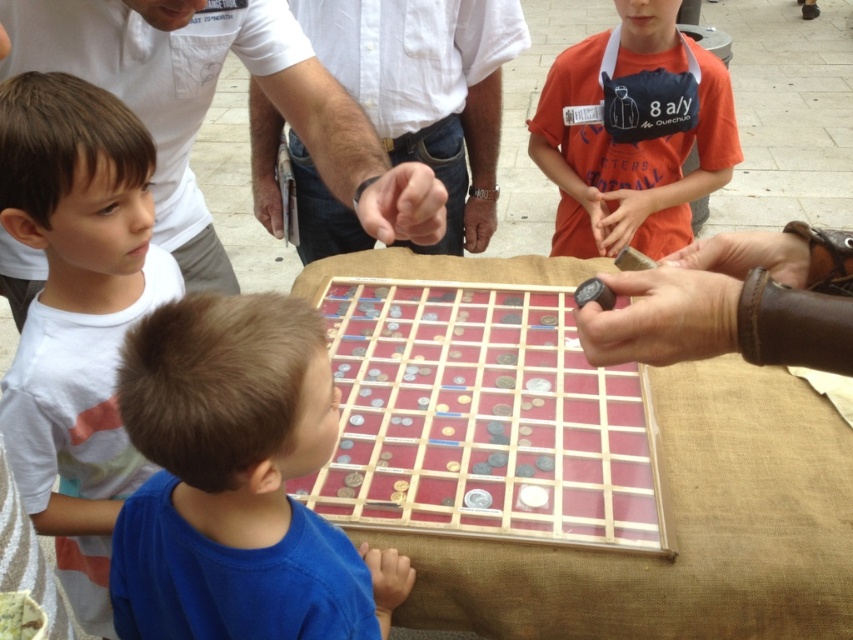
Is point (392, 445) farther from camera compared to point (194, 548)?

Yes, it is behind point (194, 548).

Is point (393, 413) in front of point (311, 636)?

No, (393, 413) is behind (311, 636).

Which is in front, point (612, 388) or point (213, 429)?

Positioned in front is point (213, 429).

At what (x,y) coordinates should I click in order to perform the action: click on wooden grid at center. Please return your answer as a coordinate pair (x, y). The image size is (853, 640). Looking at the image, I should click on (485, 419).

Between white cotton shirt at left and white shirt at upper center, which one is positioned lower?

Positioned lower is white cotton shirt at left.

Can you confirm if white cotton shirt at left is positioned to the right of white shirt at upper center?

No, white cotton shirt at left is not to the right of white shirt at upper center.

Between point (44, 449) and point (184, 36), which one is positioned in front?

Positioned in front is point (44, 449).

Image resolution: width=853 pixels, height=640 pixels. In order to click on white cotton shirt at left in this screenshot , I will do `click(77, 312)`.

This screenshot has height=640, width=853. What are the coordinates of `wooden grid at center` in the screenshot? It's located at (485, 419).

In the scene shown: Which is below, wooden grid at center or orange cotton shirt at upper right?

wooden grid at center

Is point (344, 326) positioned after point (675, 129)?

No, it is in front of (675, 129).

At what (x,y) coordinates should I click in order to perform the action: click on wooden grid at center. Please return your answer as a coordinate pair (x, y). The height and width of the screenshot is (640, 853). Looking at the image, I should click on (485, 419).